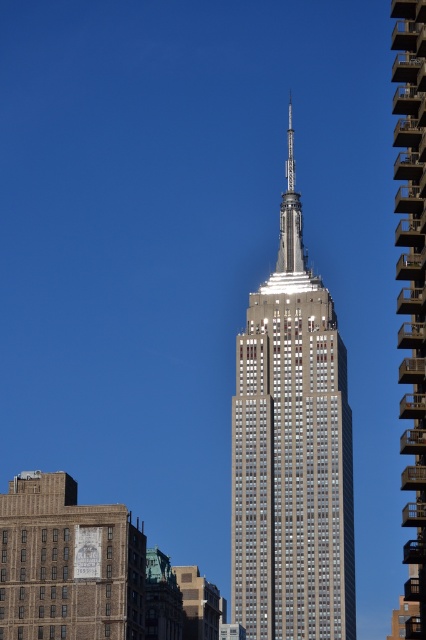
Is silver metallic building at center to the right of glassy steel building at center from the viewer's perspective?

No, silver metallic building at center is not to the right of glassy steel building at center.

Is point (244, 419) in front of point (405, 196)?

That is False.

I want to click on silver metallic building at center, so [291, 452].